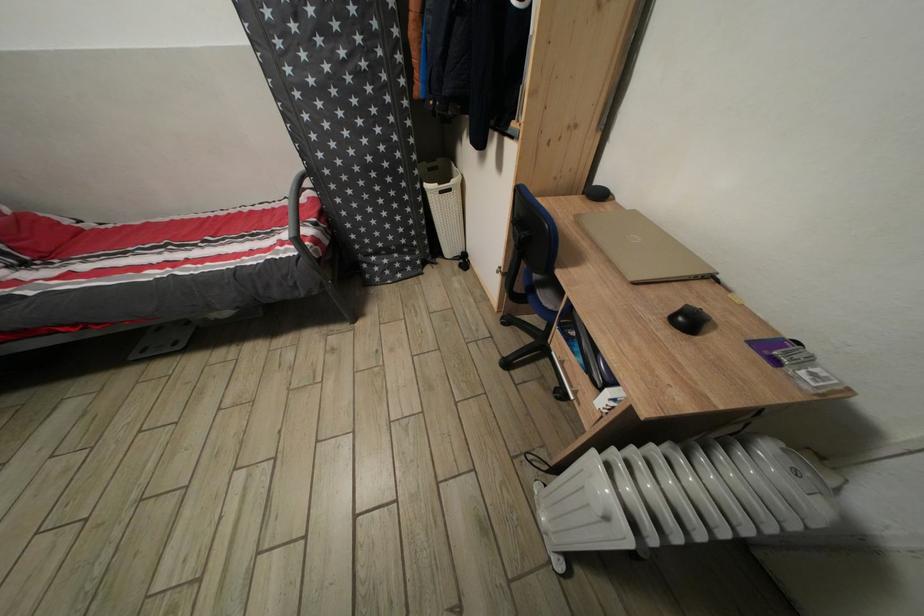
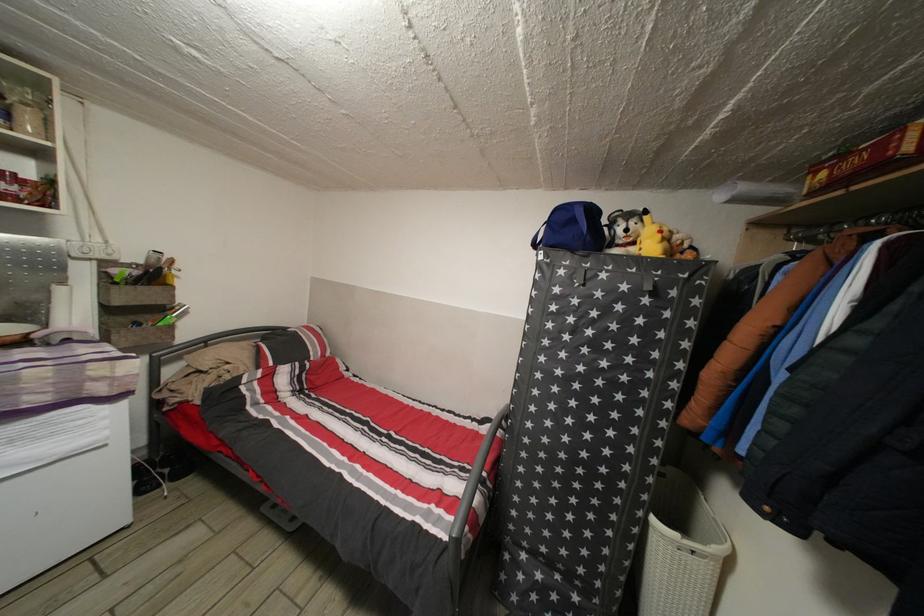
The first image is from the beginning of the video and the second image is from the end. How did the camera likely rotate when shooting the video?

The camera's rotation is toward left-up.